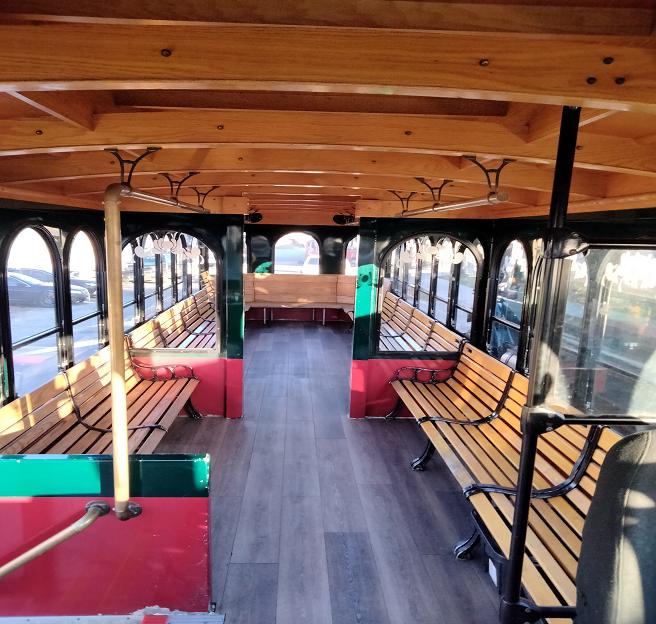
The image size is (656, 624). What are the coordinates of `trolley bars` in the screenshot? It's located at (435, 202), (172, 196), (109, 233), (563, 187).